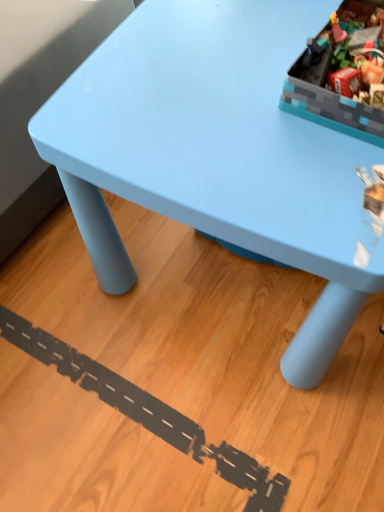
At what (x,y) coordinates should I click in order to perform the action: click on vacant space positioned to the left of matte plastic storage box at upper right. Please return your answer as a coordinate pair (x, y). Looking at the image, I should click on (213, 94).